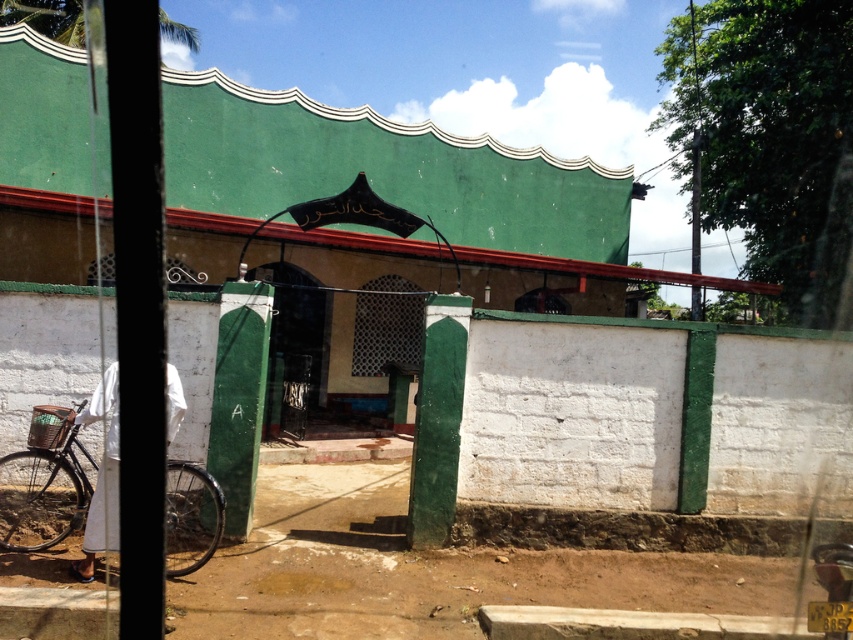
Is brown dirt track at lower left positioned at the back of black matte bicycle at left?

No, brown dirt track at lower left is in front of black matte bicycle at left.

Between point (575, 593) and point (71, 515), which one is positioned behind?

Point (71, 515)

Is point (207, 592) farther from viewer compared to point (13, 538)?

No, it is in front of (13, 538).

Locate an element on the screen. brown dirt track at lower left is located at coordinates (427, 570).